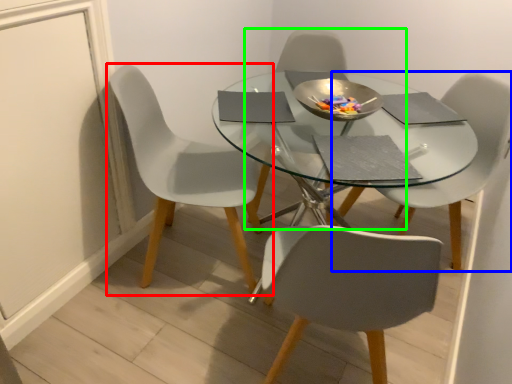
Question: Which is farther away from chair (highlighted by a red box)? chair (highlighted by a blue box) or chair (highlighted by a green box)?

Choices:
 (A) chair
 (B) chair

Answer: (A)